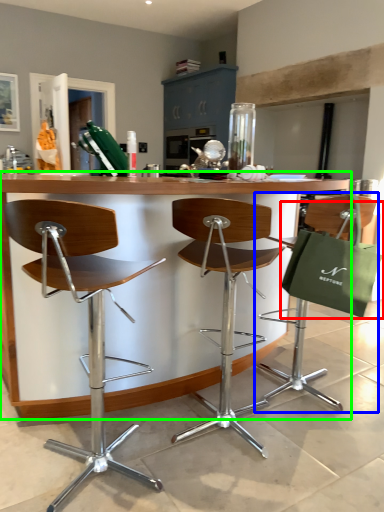
Question: Which object is the farthest from shopping bag (highlighted by a red box)? Choose among these: chair (highlighted by a blue box) or table (highlighted by a green box).

Choices:
 (A) chair
 (B) table

Answer: (B)